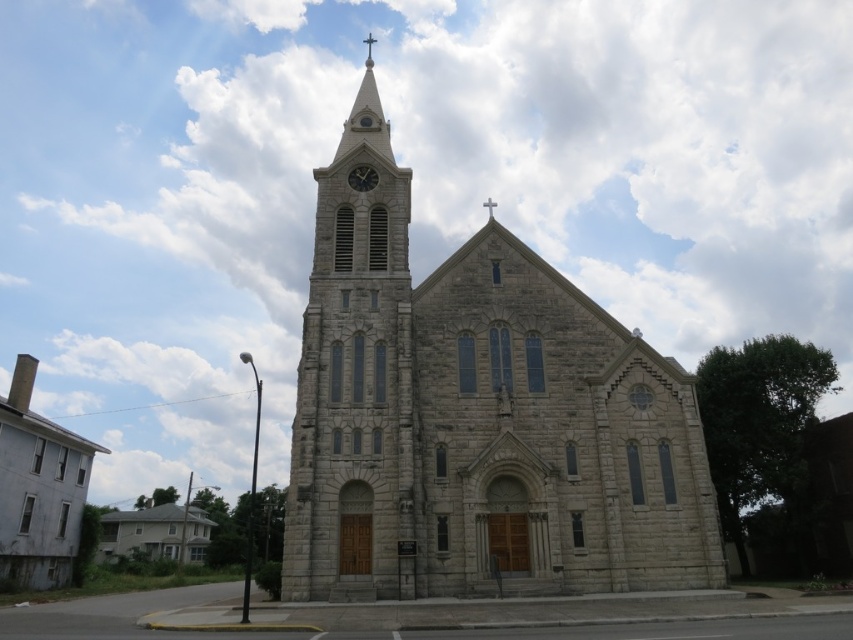
Question: Is gray stone church at left in front of matte gray clock at center?

Choices:
 (A) no
 (B) yes

Answer: (A)

Question: Which is farther from the matte gray clock at center?

Choices:
 (A) gray stone clock tower at center-left
 (B) gray stone church at center
 (C) gray stone church at left

Answer: (C)

Question: Is gray stone church at left bigger than matte gray clock at center?

Choices:
 (A) yes
 (B) no

Answer: (A)

Question: Does gray stone church at center appear on the left side of gray stone church at left?

Choices:
 (A) no
 (B) yes

Answer: (A)

Question: Which object is farther from the camera taking this photo?

Choices:
 (A) gray stone clock tower at center-left
 (B) gray stone church at center

Answer: (A)

Question: Which point appears farthest from the camera in this image?

Choices:
 (A) (56, 560)
 (B) (369, 188)
 (C) (410, 305)

Answer: (A)